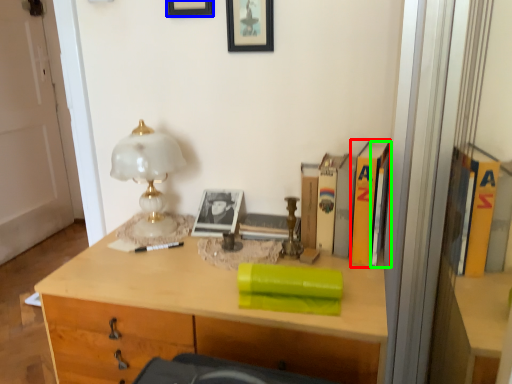
Question: Considering the real-world distances, which object is farthest from paperback book (highlighted by a red box)? picture frame (highlighted by a blue box) or book (highlighted by a green box)?

Choices:
 (A) picture frame
 (B) book

Answer: (A)